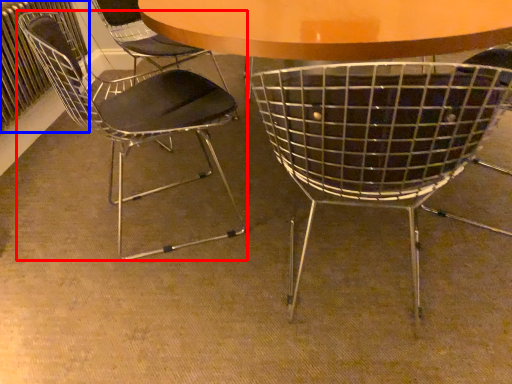
Question: Which object appears closest to the camera in this image, chair (highlighted by a red box) or radiator (highlighted by a blue box)?

Choices:
 (A) chair
 (B) radiator

Answer: (A)